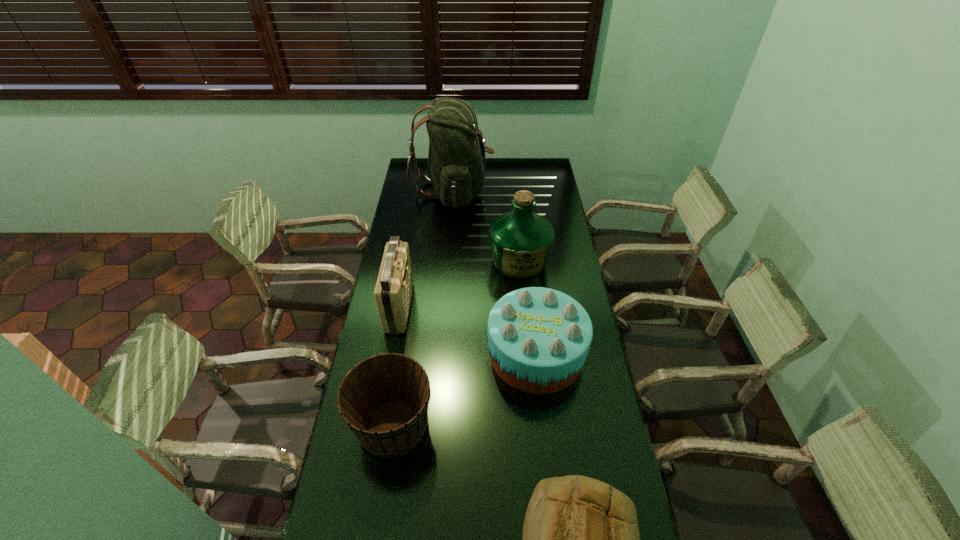
Locate an element on the screen. vacant space at the right edge is located at coordinates (572, 266).

Locate an element on the screen. The width and height of the screenshot is (960, 540). vacant space at the far left corner of the desktop is located at coordinates (422, 167).

Find the location of a particular element. vacant area that lies between the wine bucket and the farthest object is located at coordinates (423, 308).

I want to click on free spot between the tallest object and the liquor, so click(486, 226).

Locate an element on the screen. empty location between the third tallest object and the tallest object is located at coordinates (426, 248).

Locate an element on the screen. Image resolution: width=960 pixels, height=540 pixels. free space between the wine bucket and the cake is located at coordinates (465, 390).

What are the coordinates of `vacant space that's between the third tallest object and the liquor` in the screenshot? It's located at (459, 284).

Where is `vacant space that is in between the cake and the radio receiver`? This screenshot has height=540, width=960. vacant space that is in between the cake and the radio receiver is located at coordinates (468, 330).

Where is `unoccupied area between the cake and the third tallest object`? The image size is (960, 540). unoccupied area between the cake and the third tallest object is located at coordinates (468, 330).

Point out which object is positioned as the fourth nearest to the cake. Please provide its 2D coordinates. Your answer should be formatted as a tuple, i.e. [(x, y)], where the tuple contains the x and y coordinates of a point satisfying the conditions above.

[(393, 291)]